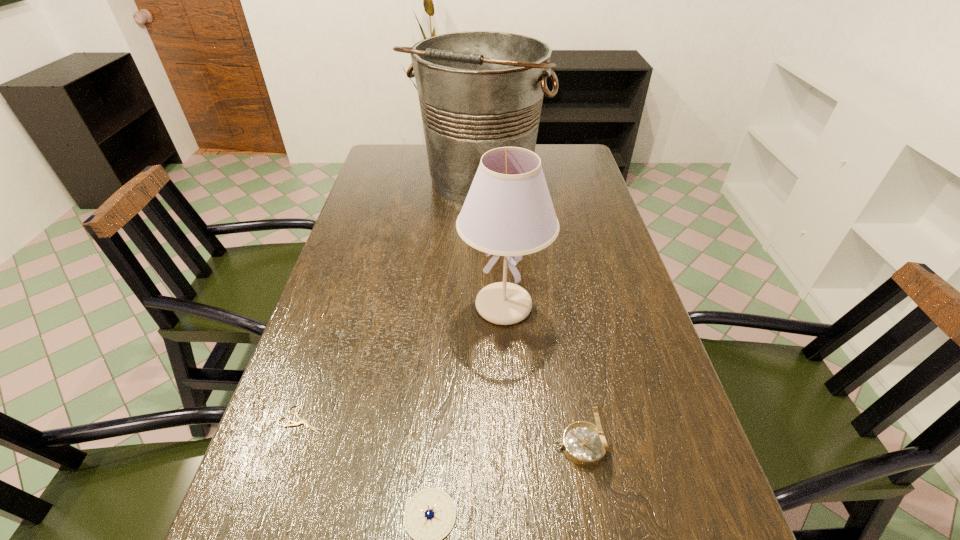
At what (x,y) coordinates should I click in order to perform the action: click on vacant space at the right edge of the desktop. Please return your answer as a coordinate pair (x, y). Image resolution: width=960 pixels, height=540 pixels. Looking at the image, I should click on (584, 192).

This screenshot has height=540, width=960. I want to click on free space at the far left corner of the desktop, so click(380, 156).

In the image, there is a desktop. Find the location of `blank space at the far right corner`. blank space at the far right corner is located at coordinates (x=568, y=174).

Identify the location of unoccupied area between the tallest object and the taller compass. (530, 313).

The height and width of the screenshot is (540, 960). Find the location of `vacant space that's between the taller compass and the leftmost object`. vacant space that's between the taller compass and the leftmost object is located at coordinates (442, 433).

The image size is (960, 540). Find the location of `free point between the farthest object and the shortest object`. free point between the farthest object and the shortest object is located at coordinates (391, 300).

Identify the location of vacant space that's between the taller compass and the lampshade. The height and width of the screenshot is (540, 960). (542, 376).

At what (x,y) coordinates should I click in order to perform the action: click on unoccupied area between the second farthest object and the shears. Please return your answer as a coordinate pair (x, y). Looking at the image, I should click on (403, 363).

You are a GUI agent. You are given a task and a screenshot of the screen. Output one action in this format:
    pyautogui.click(x=<x>, y=<y>)
    Task: Click on the free space between the third shortest object and the fourth nearest object
    The height and width of the screenshot is (540, 960).
    Given the screenshot: What is the action you would take?
    click(x=542, y=376)

Locate an element on the screen. vacant region between the third shortest object and the bucket is located at coordinates (530, 313).